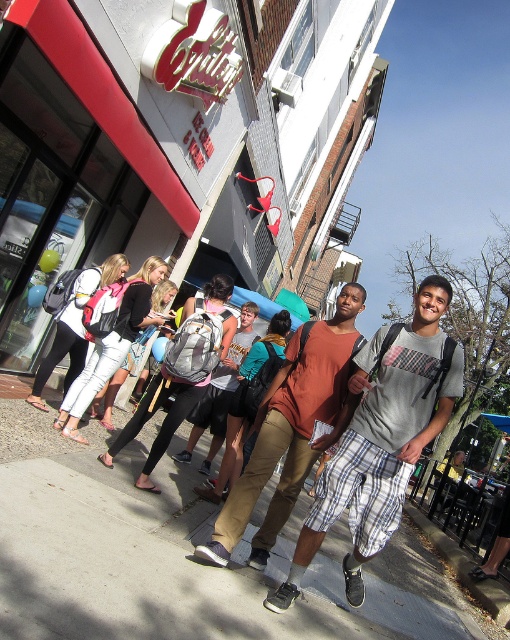
Question: Is the position of gray cotton t-shirt at center more distant than that of brown cotton shirt at center?

Choices:
 (A) yes
 (B) no

Answer: (B)

Question: Which of the following is the farthest from the observer?

Choices:
 (A) gray cotton t-shirt at center
 (B) brown cotton shirt at center
 (C) gray concrete sidewalk at center

Answer: (B)

Question: Does gray concrete sidewalk at center have a lesser width compared to gray cotton t-shirt at center?

Choices:
 (A) no
 (B) yes

Answer: (A)

Question: Is gray concrete sidewalk at center below brown cotton shirt at center?

Choices:
 (A) no
 (B) yes

Answer: (B)

Question: Which object is farther from the camera taking this photo?

Choices:
 (A) gray cotton t-shirt at center
 (B) gray concrete sidewalk at center
 (C) brown cotton shirt at center

Answer: (C)

Question: Which point appears closest to the camera in this image?

Choices:
 (A) (310, 417)
 (B) (376, 355)

Answer: (B)